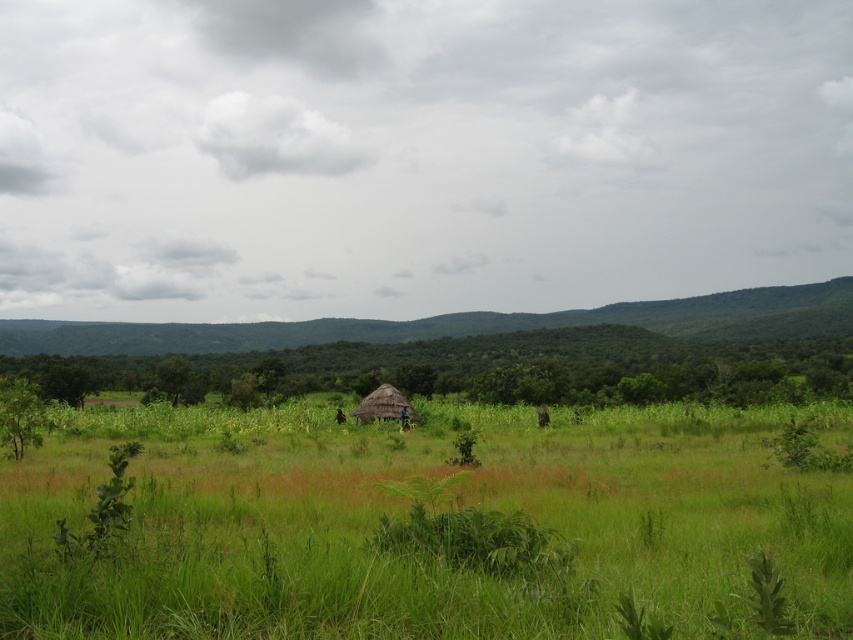
Is green grassy field at center thinner than thatched straw hut at center?

No, green grassy field at center is not thinner than thatched straw hut at center.

How distant is green grassy field at center from thatched straw hut at center?

green grassy field at center and thatched straw hut at center are 17.86 meters apart.

Does point (799, 493) come farther from viewer compared to point (361, 404)?

No, (799, 493) is closer to viewer.

Identify the location of green grassy field at center. Image resolution: width=853 pixels, height=640 pixels. (430, 524).